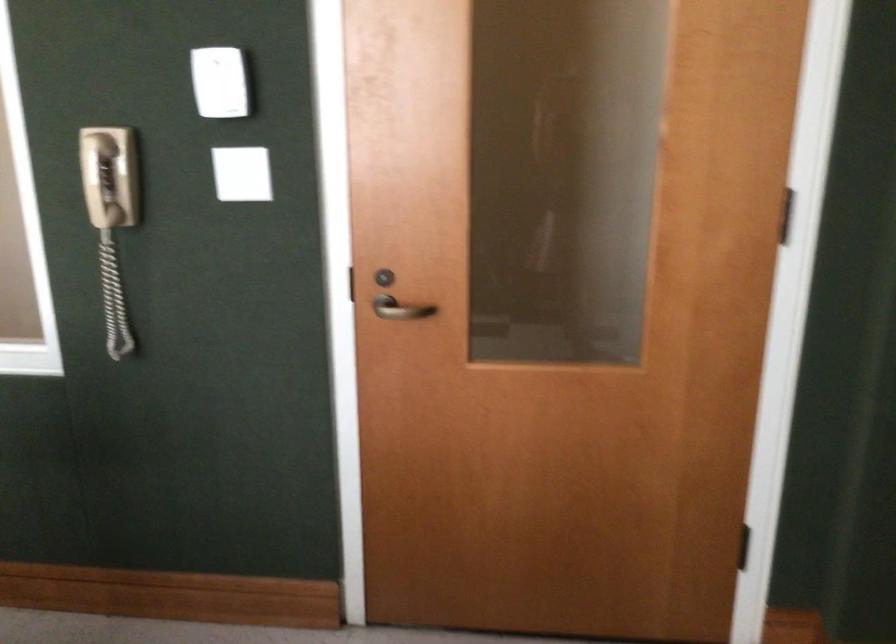
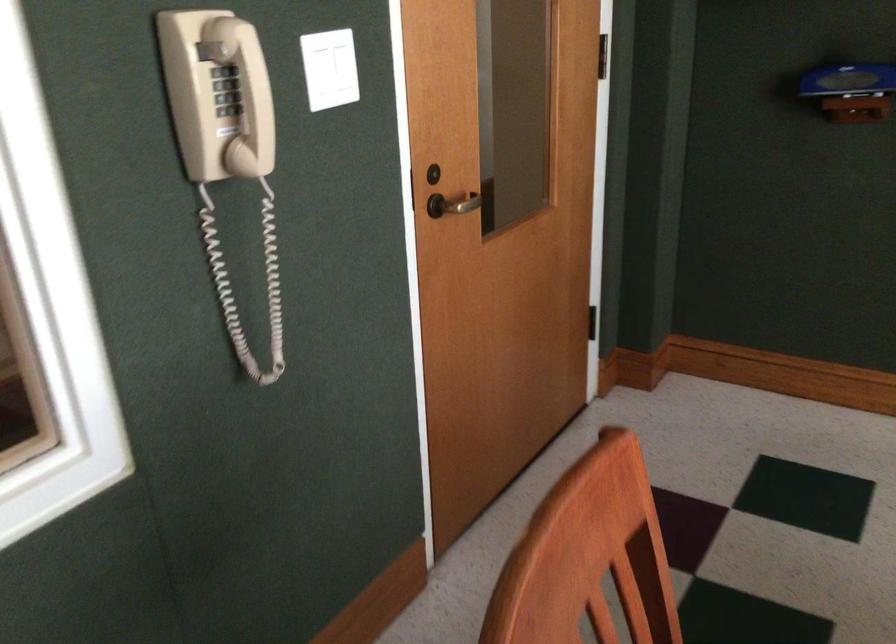
In the second image, find the point that corresponds to (x=237, y=180) in the first image.

(330, 69)